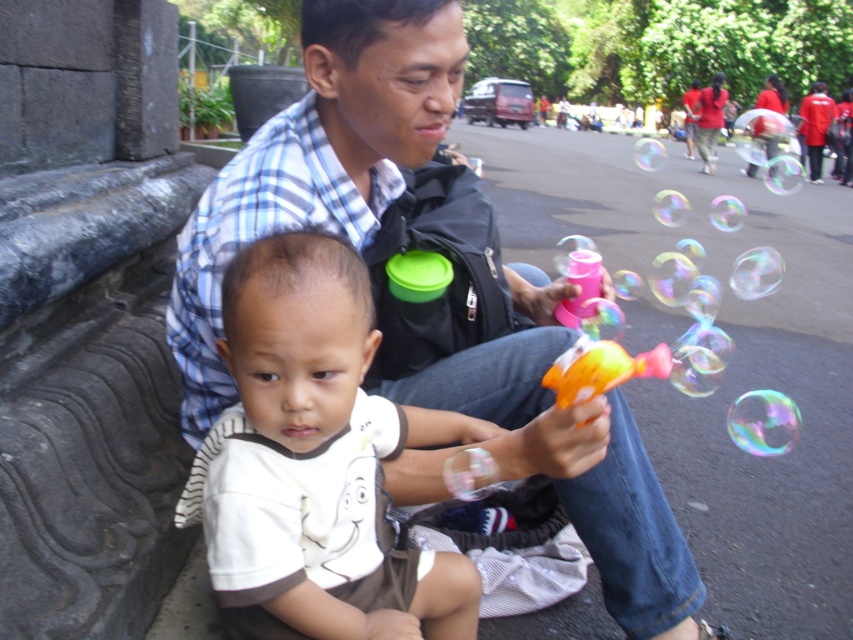
Can you confirm if white cotton shirt at center is smaller than orange plastic toy at lower center?

No, white cotton shirt at center is not smaller than orange plastic toy at lower center.

Between point (352, 406) and point (668, 353), which one is positioned behind?

Positioned behind is point (668, 353).

Is point (352, 593) less distant than point (596, 372)?

No, it is behind (596, 372).

Find the location of `white cotton shirt at center`. white cotton shirt at center is located at coordinates (315, 460).

Can you confirm if matte blue shirt at center is positioned below white cotton shirt at center?

No, matte blue shirt at center is not below white cotton shirt at center.

Between matte blue shirt at center and white cotton shirt at center, which one appears on the right side from the viewer's perspective?

From the viewer's perspective, matte blue shirt at center appears more on the right side.

This screenshot has width=853, height=640. I want to click on matte blue shirt at center, so coord(317,161).

Consider the image. Does matte blue shirt at center have a lesser height compared to orange plastic toy at lower center?

Incorrect, matte blue shirt at center's height does not fall short of orange plastic toy at lower center's.

Based on the photo, can you confirm if matte blue shirt at center is thinner than orange plastic toy at lower center?

No, matte blue shirt at center is not thinner than orange plastic toy at lower center.

I want to click on matte blue shirt at center, so click(317, 161).